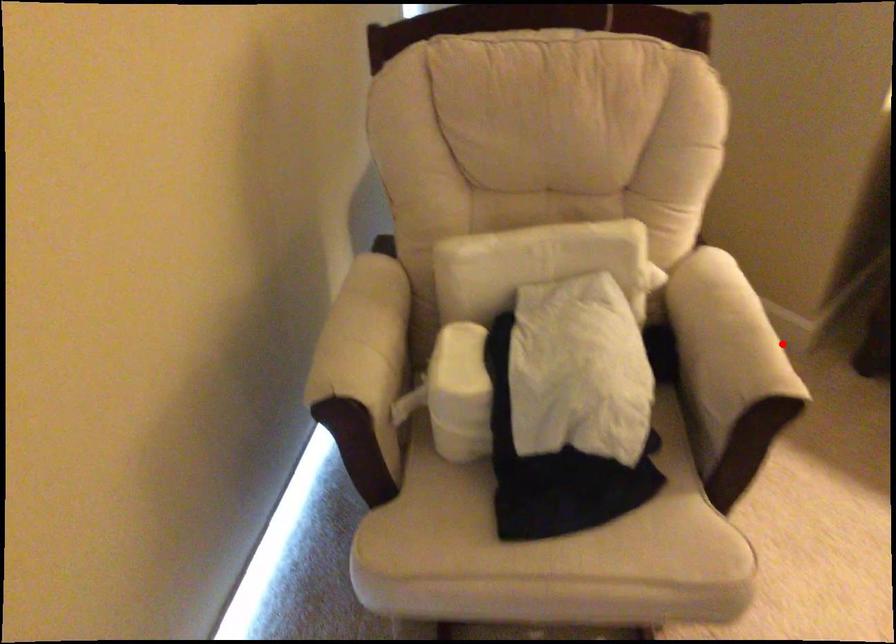
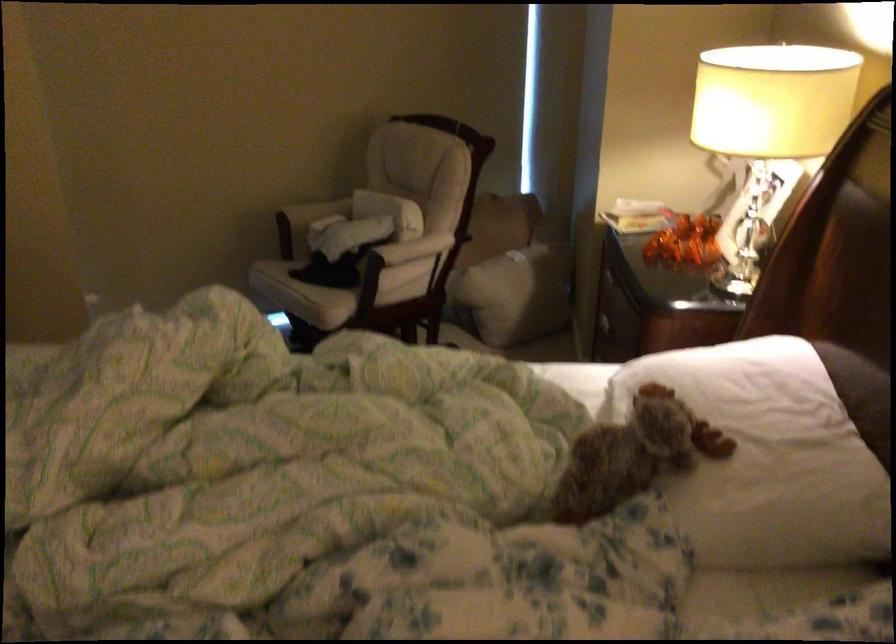
Question: I am providing you with two images of the same scene from different viewpoints. Image1 has a red point marked. In image2, the corresponding 3D location appears at what relative position? Reply with the corresponding letter.

Choices:
 (A) Closer
 (B) Farther

Answer: (B)